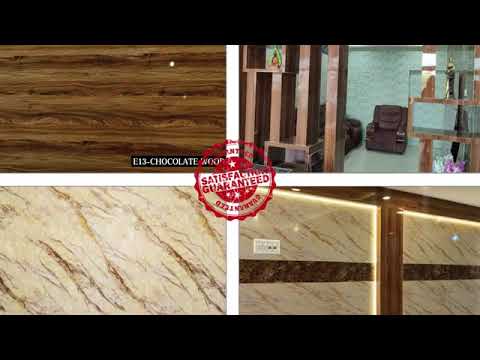
Where is `chairs`? chairs is located at coordinates click(x=376, y=128), click(x=351, y=132).